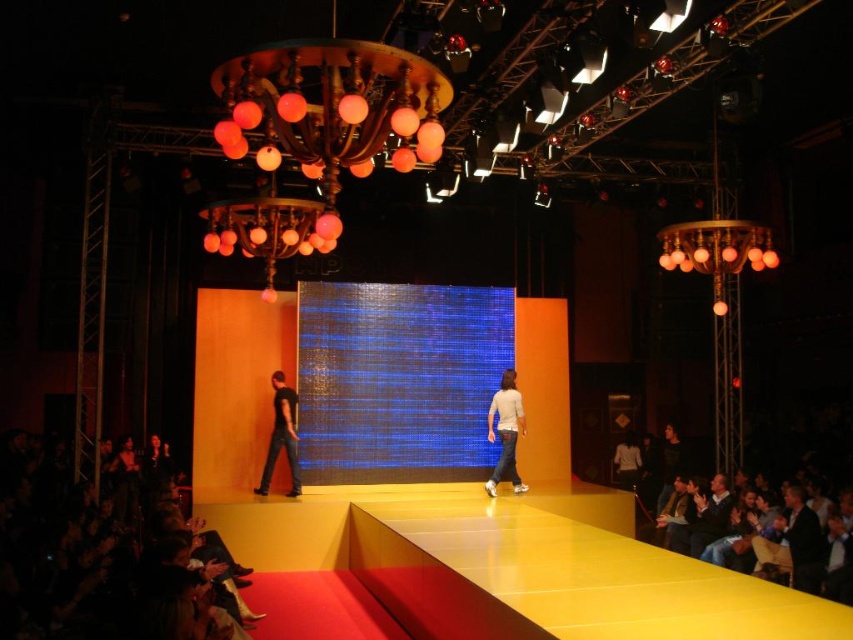
You are a stagehand responsible for setting up the runway. You need to place a new decorative item between the matte orange glass chandelier at upper right and the black matte jeans at lower left. Based on their positions, which object is positioned higher in the image?

The matte orange glass chandelier at upper right is positioned higher in the image than the black matte jeans at lower left.

You are a photographer at the fashion show. You need to capture a closeup shot of the black matte jeans at lower left and dark blue shirt at lower right. Since your camera can only focus on one object at a time, which object should you adjust the focus to first if you want to ensure both are in focus without moving the camera?

The black matte jeans at lower left has a smaller width than the dark blue shirt at lower right. To ensure both are in focus, you should focus on the black matte jeans at lower left first because it is closer to the camera, allowing the dark blue shirt at lower right to fall within the depth of field.

You are a photographer positioned at the front of the runway. You want to capture a photo that includes both the point at (761,225) and the point at (291,413). Considering their positions, which point will appear larger in your photo?

Point at (761,225) will appear larger in the photo because it is closer to the viewer than point at (291,413).